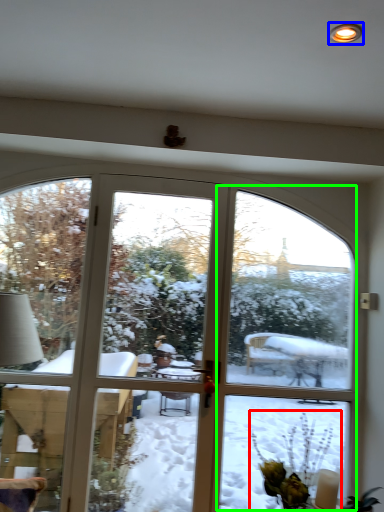
Question: Estimate the real-world distances between objects in this image. Which object is farther from floral arrangement (highlighted by a red box), light (highlighted by a blue box) or screen door (highlighted by a green box)?

Choices:
 (A) light
 (B) screen door

Answer: (A)